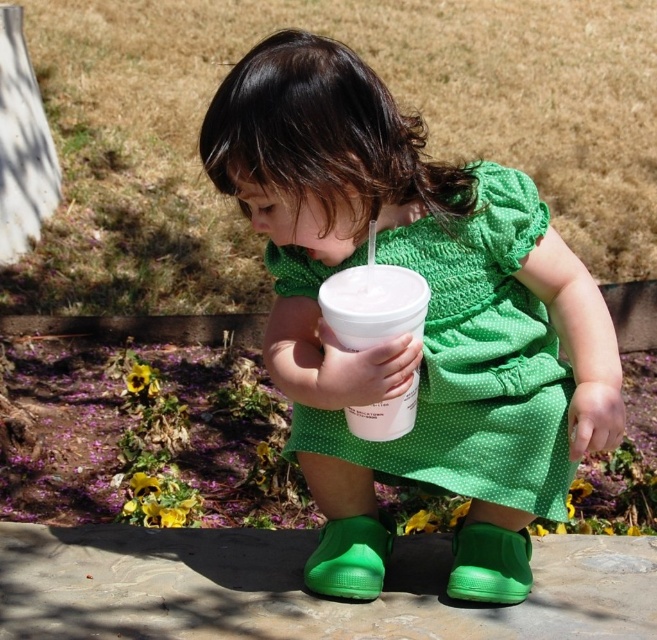
Who is positioned more to the right, green matte dress at center or white plastic cup at center?

Positioned to the right is green matte dress at center.

Looking at this image, who is lower down, green matte dress at center or white plastic cup at center?

white plastic cup at center

Identify the location of green matte dress at center. The image size is (657, 640). (424, 321).

Where is `green matte dress at center`? The image size is (657, 640). green matte dress at center is located at coordinates (424, 321).

Does green dotted dress at center have a larger size compared to white plastic cup at center?

Yes, green dotted dress at center is bigger than white plastic cup at center.

Does green dotted dress at center have a greater height compared to white plastic cup at center?

Correct, green dotted dress at center is much taller as white plastic cup at center.

The width and height of the screenshot is (657, 640). Find the location of `green dotted dress at center`. green dotted dress at center is located at coordinates (472, 362).

Is green matte dress at center smaller than green dotted dress at center?

No.

From the picture: Measure the distance between point (256, 122) and camera.

Point (256, 122) and camera are 4.98 feet apart.

What do you see at coordinates (424, 321) in the screenshot? I see `green matte dress at center` at bounding box center [424, 321].

You are a GUI agent. You are given a task and a screenshot of the screen. Output one action in this format:
    pyautogui.click(x=<x>, y=<y>)
    Task: Click on the green matte dress at center
    The width and height of the screenshot is (657, 640).
    Given the screenshot: What is the action you would take?
    pyautogui.click(x=424, y=321)